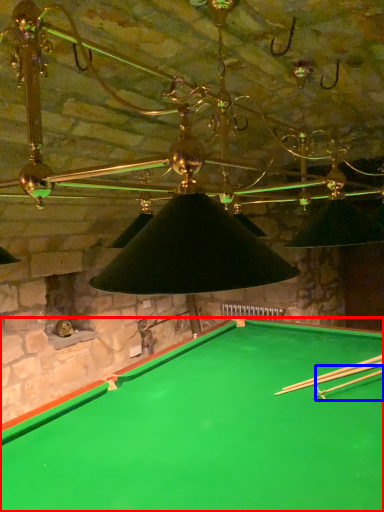
Question: Which object appears farthest to the camera in this image, billiard table (highlighted by a red box) or cue (highlighted by a blue box)?

Choices:
 (A) billiard table
 (B) cue

Answer: (B)